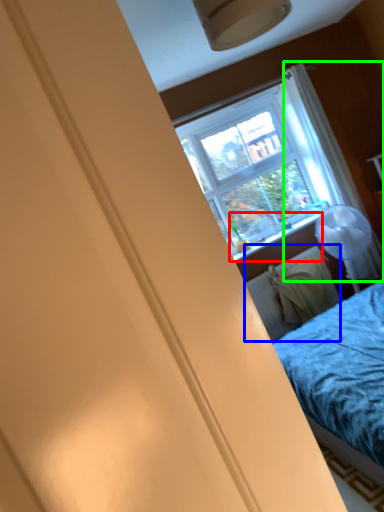
Question: Based on their relative distances, which object is farther from window sill (highlighted by a red box)? Choose from radiator (highlighted by a blue box) and curtain (highlighted by a green box).

Choices:
 (A) radiator
 (B) curtain

Answer: (B)